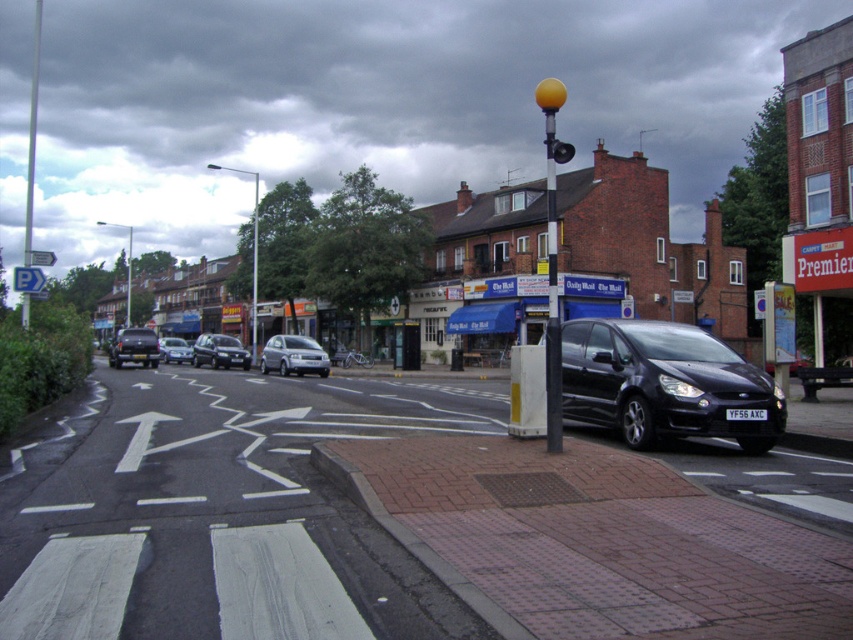
Is satin silver car at center to the left of shiny black car at center-left from the viewer's perspective?

Incorrect, satin silver car at center is not on the left side of shiny black car at center-left.

The image size is (853, 640). I want to click on satin silver car at center, so click(293, 355).

Locate an element on the screen. The width and height of the screenshot is (853, 640). satin silver car at center is located at coordinates (293, 355).

Based on the photo, does matte silver car at center appear over yellow matte traffic light at upper center?

No, matte silver car at center is not above yellow matte traffic light at upper center.

Does matte silver car at center come behind yellow matte traffic light at upper center?

Yes.

Does point (200, 362) come farther from viewer compared to point (573, 147)?

No, (200, 362) is in front of (573, 147).

You are a GUI agent. You are given a task and a screenshot of the screen. Output one action in this format:
    pyautogui.click(x=<x>, y=<y>)
    Task: Click on the matte silver car at center
    The width and height of the screenshot is (853, 640).
    Given the screenshot: What is the action you would take?
    pyautogui.click(x=219, y=352)

Does satin silver car at center have a greater width compared to white plastic pole at left?

No, satin silver car at center is not wider than white plastic pole at left.

What do you see at coordinates (293, 355) in the screenshot? Image resolution: width=853 pixels, height=640 pixels. I see `satin silver car at center` at bounding box center [293, 355].

Is point (281, 352) positioned in front of point (35, 90)?

Yes, point (281, 352) is closer to viewer.

At what (x,y) coordinates should I click in order to perform the action: click on satin silver car at center. Please return your answer as a coordinate pair (x, y). This screenshot has width=853, height=640. Looking at the image, I should click on (293, 355).